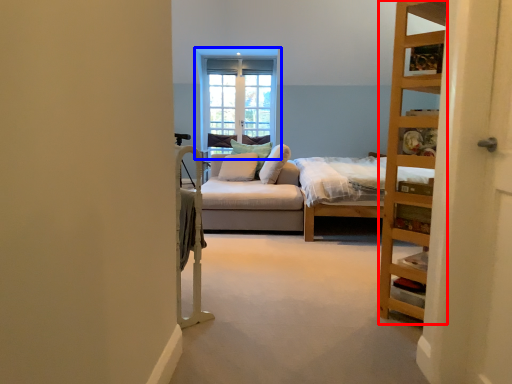
Question: Which of the following is the closest to the observer, shelf (highlighted by a red box) or window (highlighted by a blue box)?

Choices:
 (A) shelf
 (B) window

Answer: (A)